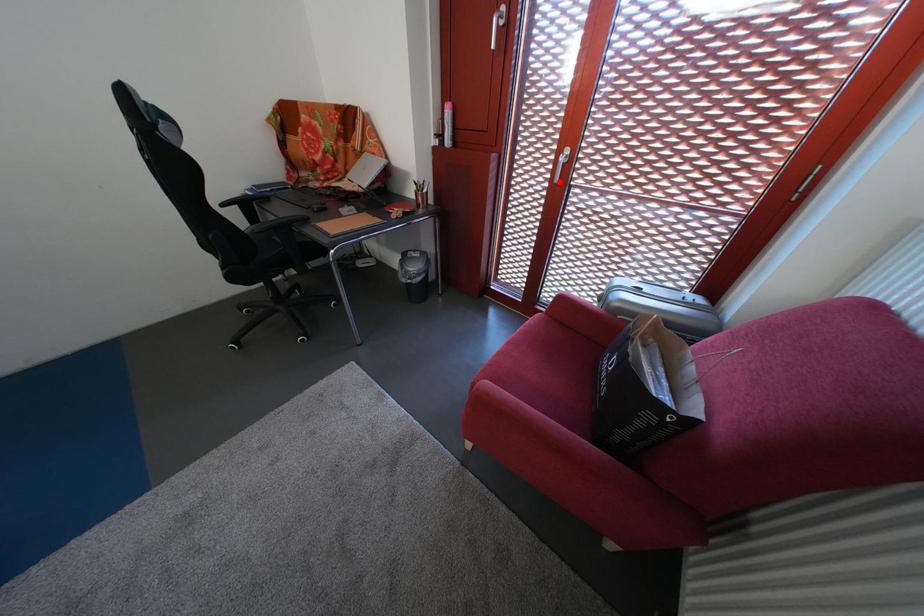
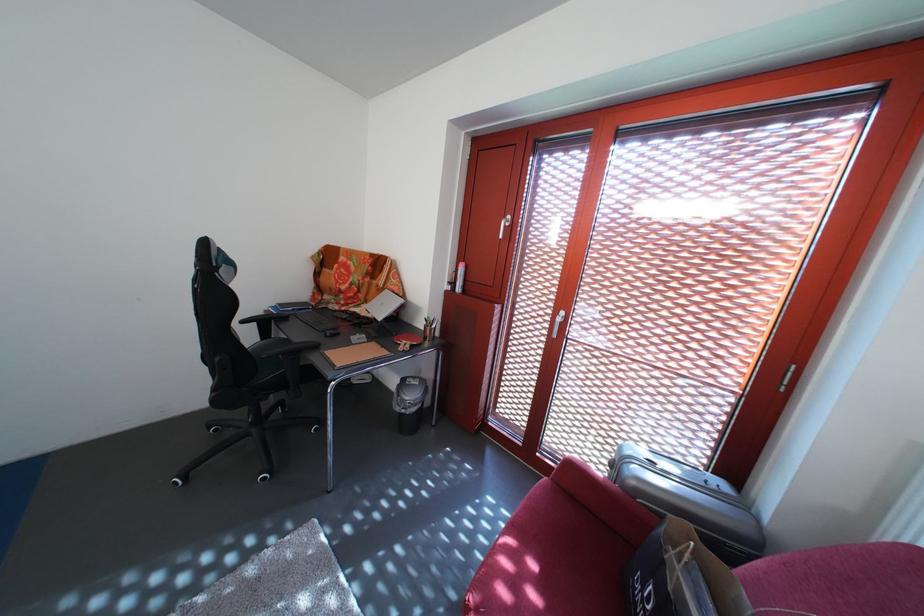
Question: I am providing you with two images of the same scene from different viewpoints. Image1 has a red point marked. In image2, the corresponding 3D location appears at what relative position? Reply with the corresponding letter.

Choices:
 (A) Closer
 (B) Farther

Answer: (B)